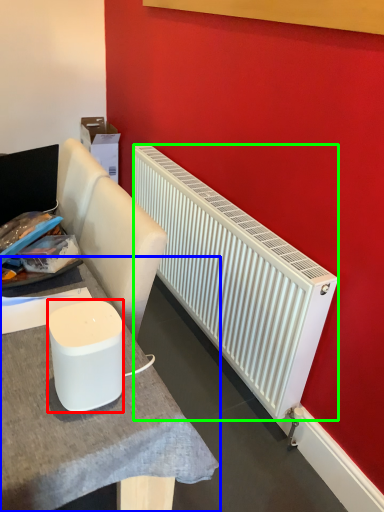
Question: Which object is the farthest from appliance (highlighted by a red box)? Choose among these: table (highlighted by a blue box) or radiator (highlighted by a green box).

Choices:
 (A) table
 (B) radiator

Answer: (B)